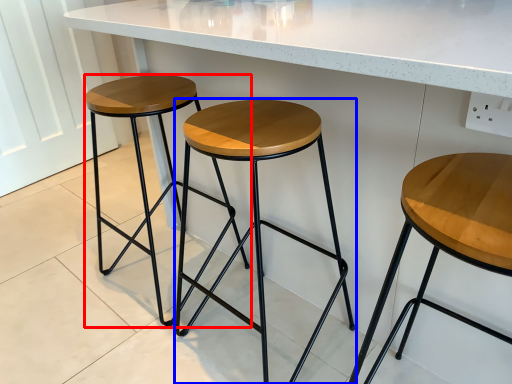
Question: Which object appears farthest to the camera in this image, stool (highlighted by a red box) or stool (highlighted by a blue box)?

Choices:
 (A) stool
 (B) stool

Answer: (A)